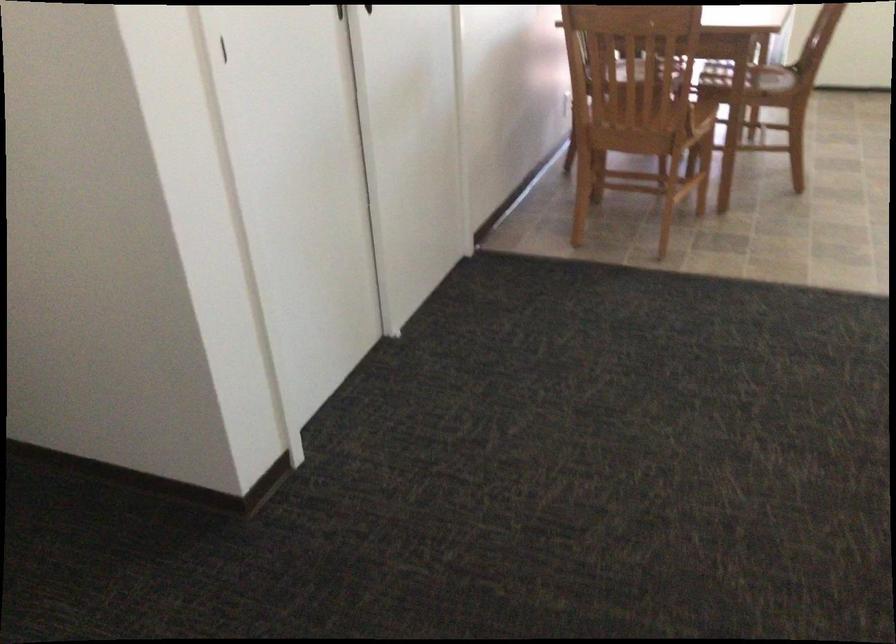
Find the location of a particular element. The image size is (896, 644). recessed door pull is located at coordinates (222, 50).